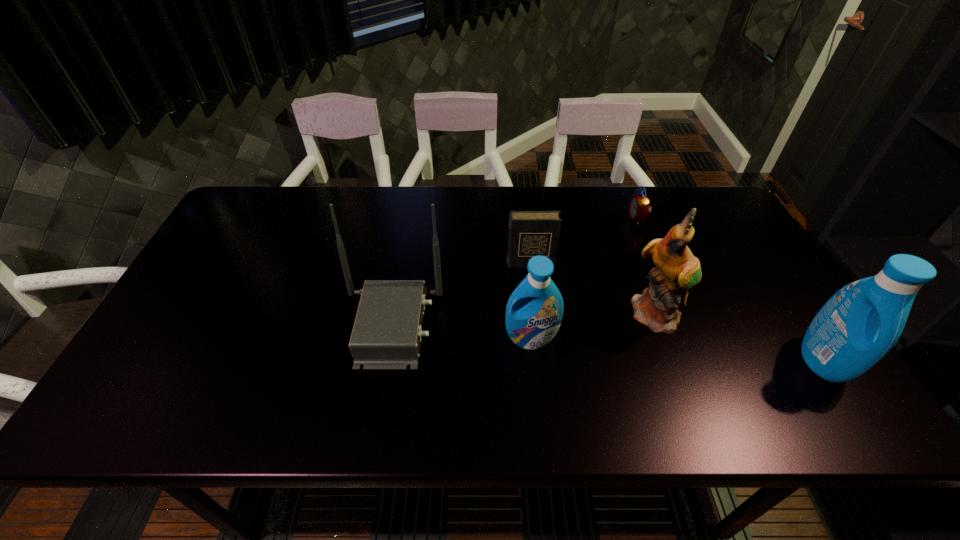
Locate an element on the screen. vacant space located on the front-facing side of the shorter detergent is located at coordinates (536, 382).

The image size is (960, 540). Identify the location of vacant region located 0.110m on the front-facing side of the parrot. (680, 377).

I want to click on vacant position located 0.190m on the front cover of the fifth nearest object, so click(x=537, y=321).

Find the location of a particular element. The height and width of the screenshot is (540, 960). free space located on the front-facing side of the alarm clock is located at coordinates (551, 219).

I want to click on free space located on the front-facing side of the alarm clock, so click(x=588, y=219).

Identify the location of blank space located 0.200m on the front-facing side of the alarm clock. (566, 219).

Find the location of a particular element. This screenshot has width=960, height=540. vacant point located 0.330m on the back of the leftmost object to connect cables is located at coordinates (573, 326).

Image resolution: width=960 pixels, height=540 pixels. Find the location of `object at the far edge`. object at the far edge is located at coordinates (639, 208).

You are a GUI agent. You are given a task and a screenshot of the screen. Output one action in this format:
    pyautogui.click(x=<x>, y=<y>)
    Task: Click on the detergent at the near edge
    The image size is (960, 540).
    Given the screenshot: What is the action you would take?
    pyautogui.click(x=857, y=327)

Locate an element on the screen. The width and height of the screenshot is (960, 540). router that is at the near edge is located at coordinates (387, 331).